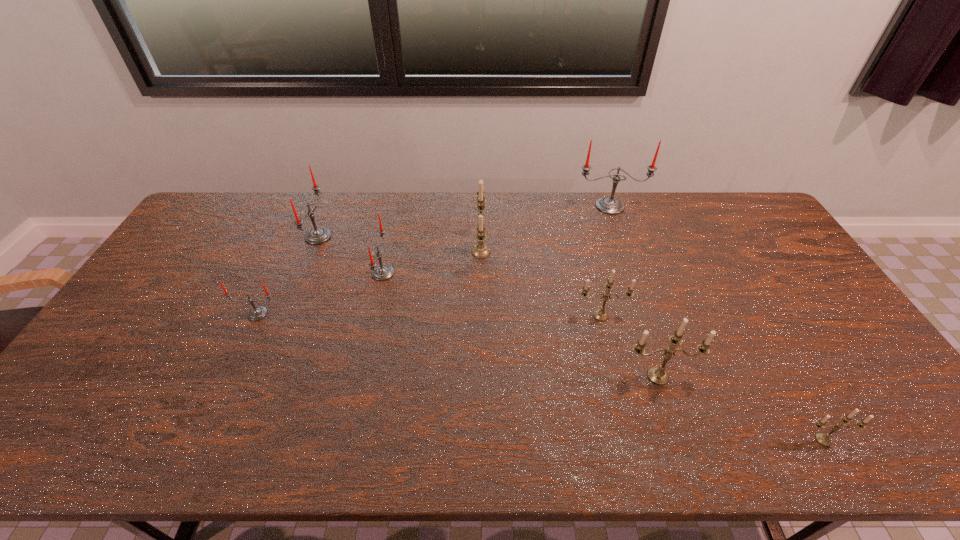
Identify the location of empty space between the second biggest red candle and the third candle from left to right. The height and width of the screenshot is (540, 960). (350, 255).

At what (x,y) coordinates should I click in order to perform the action: click on vacant space that's between the third object from left to right and the nearest red candle. Please return your answer as a coordinate pair (x, y). Looking at the image, I should click on (321, 293).

The height and width of the screenshot is (540, 960). I want to click on vacant space in between the smallest red candle and the rightmost red candle, so click(434, 260).

Find the location of a particular element. This screenshot has height=540, width=960. free space between the nearest red candle and the third smallest red candle is located at coordinates (288, 275).

The height and width of the screenshot is (540, 960). What are the coordinates of `vacant area that lies between the biggest metallic candle and the nearest candle` in the screenshot? It's located at (652, 346).

The image size is (960, 540). I want to click on free space between the nearest red candle and the farthest candle, so click(434, 260).

Where is `vacant area between the nearest red candle and the farthest metallic candle`? The image size is (960, 540). vacant area between the nearest red candle and the farthest metallic candle is located at coordinates (370, 282).

Find the location of `free space that is in between the fifth object from right to left and the farthest object`. free space that is in between the fifth object from right to left and the farthest object is located at coordinates (545, 229).

The image size is (960, 540). In order to click on the seventh closest object relative to the smallest red candle in this screenshot , I will do `click(824, 439)`.

Point out which object is positioned as the seventh nearest to the third biggest red candle. Please provide its 2D coordinates. Your answer should be formatted as a tuple, i.e. [(x, y)], where the tuple contains the x and y coordinates of a point satisfying the conditions above.

[(824, 439)]